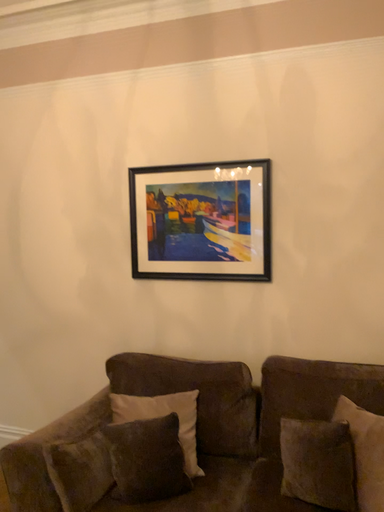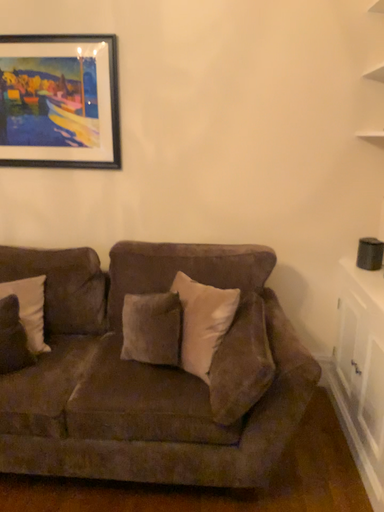
Question: Which way did the camera rotate in the video?

Choices:
 (A) rotated left
 (B) rotated right

Answer: (B)